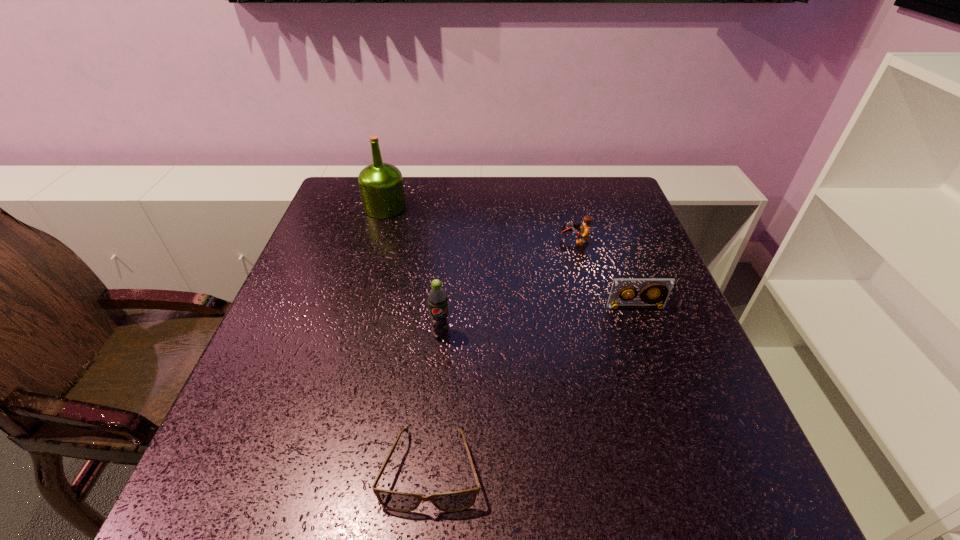
You are a GUI agent. You are given a task and a screenshot of the screen. Output one action in this format:
    pyautogui.click(x=<x>, y=<y>)
    Task: Click on the free spot located 0.380m holding a crossbow in the hands of the Lego
    The width and height of the screenshot is (960, 540).
    Given the screenshot: What is the action you would take?
    pyautogui.click(x=419, y=241)

You are a GUI agent. You are given a task and a screenshot of the screen. Output one action in this format:
    pyautogui.click(x=<x>, y=<y>)
    Task: Click on the vacant space located 0.290m holding a crossbow in the hands of the Lego
    
    Given the screenshot: What is the action you would take?
    pyautogui.click(x=452, y=241)

This screenshot has width=960, height=540. Identify the location of vacant position located holding a crossbow in the hands of the Lego. (425, 241).

Where is `vacant space positioned at the front of the videotape with visible reels`? vacant space positioned at the front of the videotape with visible reels is located at coordinates (699, 482).

At what (x,y) coordinates should I click in order to perform the action: click on object that is at the far edge. Please return your answer as a coordinate pair (x, y). The height and width of the screenshot is (540, 960). Looking at the image, I should click on (381, 186).

You are a GUI agent. You are given a task and a screenshot of the screen. Output one action in this format:
    pyautogui.click(x=<x>, y=<y>)
    Task: Click on the object located in the near edge section of the desktop
    The image size is (960, 540).
    Given the screenshot: What is the action you would take?
    pyautogui.click(x=456, y=501)

Image resolution: width=960 pixels, height=540 pixels. What are the coordinates of `object located in the left edge section of the desktop` in the screenshot? It's located at (381, 186).

Locate an element on the screen. Image resolution: width=960 pixels, height=540 pixels. Lego that is at the right edge is located at coordinates (585, 228).

You are a GUI agent. You are given a task and a screenshot of the screen. Output one action in this format:
    pyautogui.click(x=<x>, y=<y>)
    Task: Click on the videotape that is at the right edge
    
    Given the screenshot: What is the action you would take?
    662,288

Where is `object at the far left corner`? The width and height of the screenshot is (960, 540). object at the far left corner is located at coordinates (381, 186).